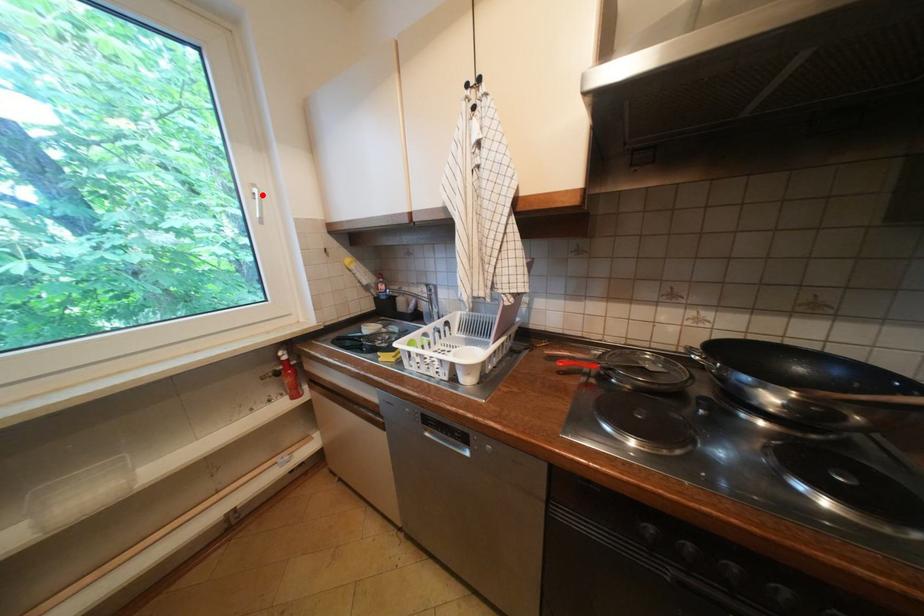
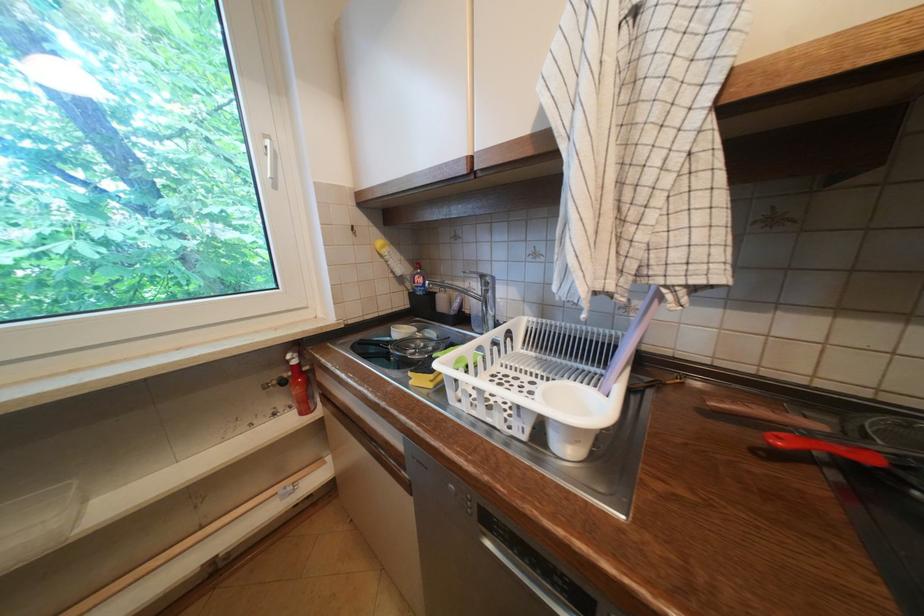
In the second image, find the point that corresponds to the highlighted location in the first image.

(274, 148)